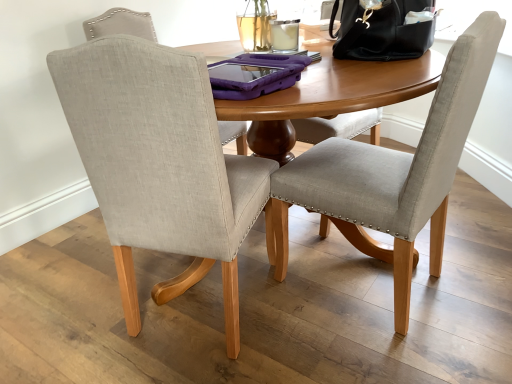
Question: Based on their sizes in the image, would you say beige fabric chair at center, the second chair in the right-to-left sequence, is bigger or smaller than light gray fabric chair at center, arranged as the 2th chair when viewed from the left?

Choices:
 (A) big
 (B) small

Answer: (A)

Question: Choose the correct answer: Is beige fabric chair at center, the second chair in the right-to-left sequence, inside light gray fabric chair at center, arranged as the 2th chair when viewed from the left, or outside it?

Choices:
 (A) inside
 (B) outside

Answer: (B)

Question: Estimate the real-world distances between objects in this image. Which object is farther from the beige fabric chair at center, the second chair in the right-to-left sequence?

Choices:
 (A) black leather handbag at upper right
 (B) light gray fabric chair at center, which ranks as the 1th chair in right-to-left order

Answer: (A)

Question: Considering the real-world distances, which object is farthest from the black leather handbag at upper right?

Choices:
 (A) beige fabric chair at center, the second chair in the right-to-left sequence
 (B) light gray fabric chair at center, arranged as the 2th chair when viewed from the left

Answer: (A)